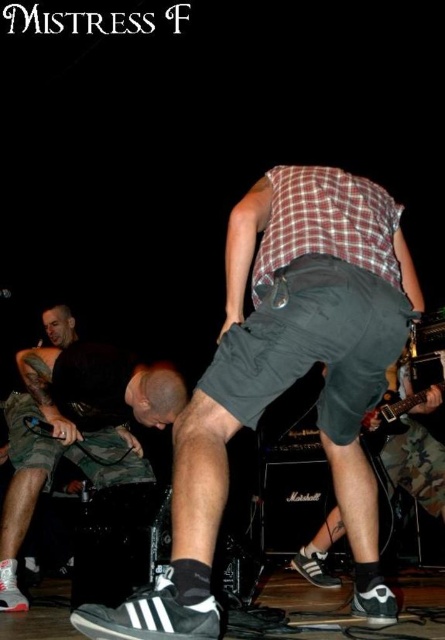
Question: Among these points, which one is nearest to the camera?

Choices:
 (A) [242, 403]
 (B) [389, 397]

Answer: (A)

Question: Among these objects, which one is farthest from the camera?

Choices:
 (A) camouflage shorts at lower left
 (B) electric guitar at lower right
 (C) dark gray cotton shorts at center

Answer: (B)

Question: Where is dark gray cotton shorts at center located in relation to electric guitar at lower right in the image?

Choices:
 (A) above
 (B) below

Answer: (A)

Question: Does camouflage shorts at lower left appear on the left side of electric guitar at lower right?

Choices:
 (A) yes
 (B) no

Answer: (A)

Question: Considering the relative positions of camouflage shorts at lower left and electric guitar at lower right in the image provided, where is camouflage shorts at lower left located with respect to electric guitar at lower right?

Choices:
 (A) above
 (B) below

Answer: (B)

Question: Considering the real-world distances, which object is closest to the dark gray cotton shorts at center?

Choices:
 (A) electric guitar at lower right
 (B) camouflage shorts at lower left

Answer: (B)